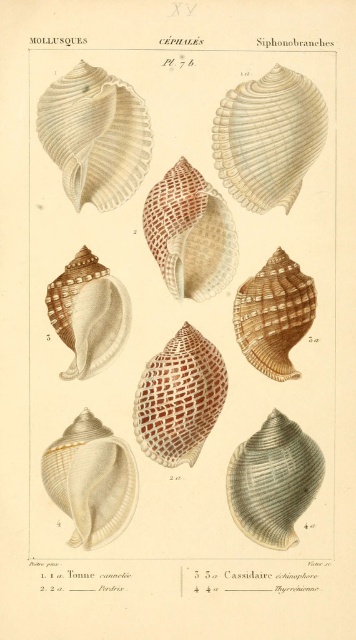
Who is shorter, brown woven shell at center or brown striped shell at center?

brown striped shell at center is shorter.

Is brown woven shell at center bigger than brown striped shell at center?

Yes, brown woven shell at center is bigger than brown striped shell at center.

What are the coordinates of `brown woven shell at center` in the screenshot? It's located at (180, 397).

Does point (170, 378) come closer to viewer compared to point (105, 449)?

That is True.

Where is `brown woven shell at center`? This screenshot has height=640, width=356. brown woven shell at center is located at coordinates (180, 397).

Is matte brown shell at upper left thinner than gray-green textured shell at center?

Incorrect, matte brown shell at upper left's width is not less than gray-green textured shell at center's.

Is matte brown shell at upper left bigger than gray-green textured shell at center?

Yes, matte brown shell at upper left is bigger than gray-green textured shell at center.

Who is more distant from viewer, (87, 154) or (234, 451)?

The point (234, 451) is more distant.

At what (x,y) coordinates should I click in order to perform the action: click on matte brown shell at upper left. Please return your answer as a coordinate pair (x, y). Looking at the image, I should click on click(95, 134).